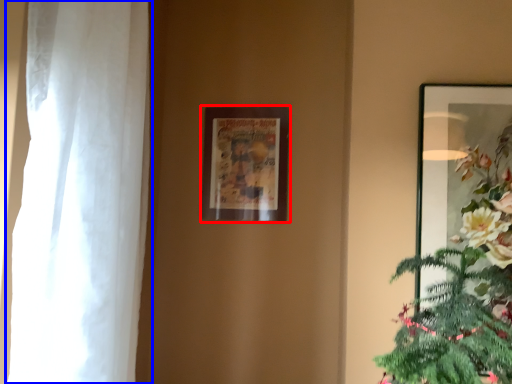
Question: Which of the following is the closest to the observer, picture frame (highlighted by a red box) or curtain (highlighted by a blue box)?

Choices:
 (A) picture frame
 (B) curtain

Answer: (B)